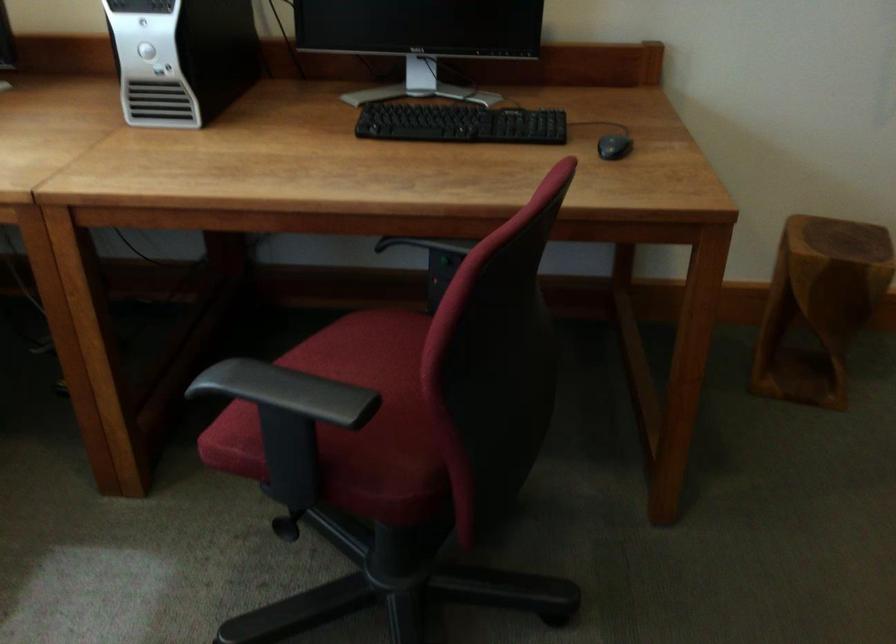
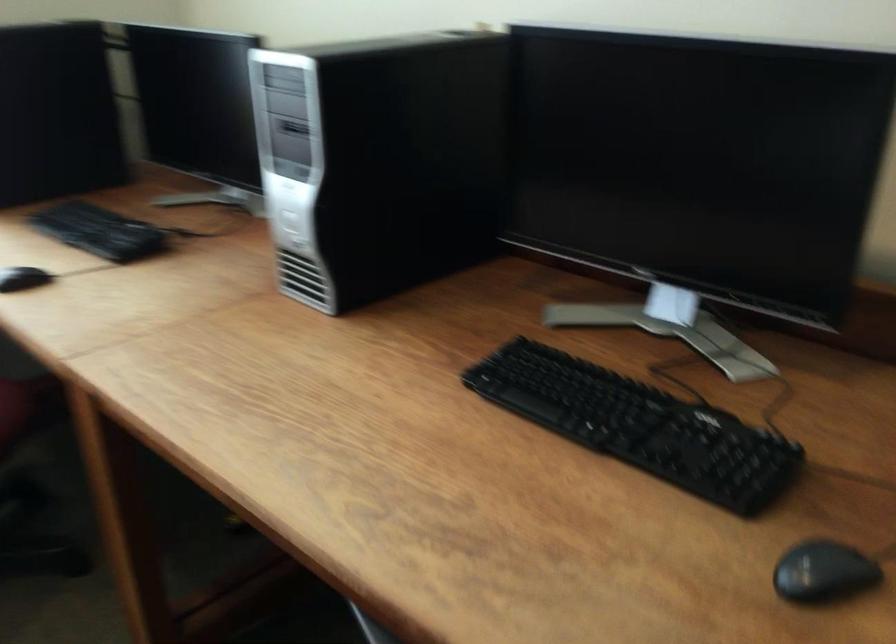
Question: The images are taken continuously from a first-person perspective. In which direction is your viewpoint rotating?

Choices:
 (A) Left
 (B) Right
 (C) Up
 (D) Down

Answer: (A)